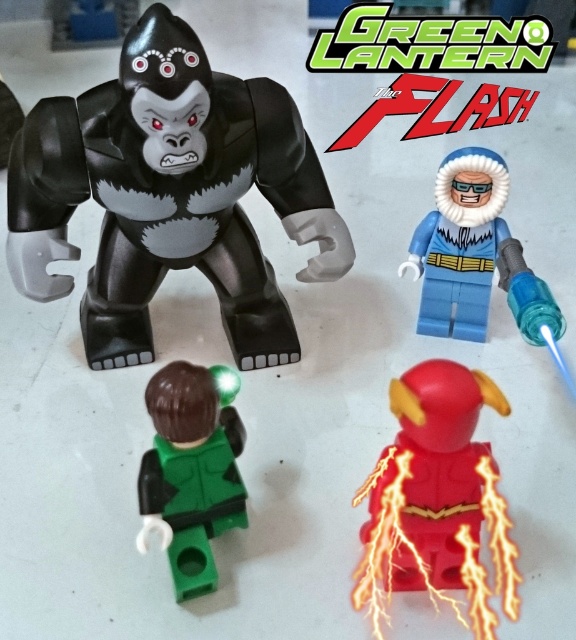
Question: Can you confirm if red matte lightning bolt at center is positioned below green glossy text at upper center?

Choices:
 (A) no
 (B) yes

Answer: (B)

Question: Considering the real-world distances, which object is farthest from the blue matte jacket at upper right?

Choices:
 (A) red matte lightning bolt at center
 (B) green matte/glossy figure at lower left
 (C) green glossy text at upper center

Answer: (B)

Question: Which object appears closest to the camera in this image?

Choices:
 (A) matte black gorilla at upper left
 (B) blue matte jacket at upper right
 (C) green glossy text at upper center

Answer: (A)

Question: From the image, what is the correct spatial relationship of matte black gorilla at upper left in relation to blue matte jacket at upper right?

Choices:
 (A) below
 (B) above

Answer: (B)

Question: Can you confirm if red matte lightning bolt at center is wider than blue matte jacket at upper right?

Choices:
 (A) yes
 (B) no

Answer: (B)

Question: Which point is closer to the camera?

Choices:
 (A) (81, 150)
 (B) (430, 577)
 (C) (533, 280)
 (D) (217, 406)

Answer: (D)